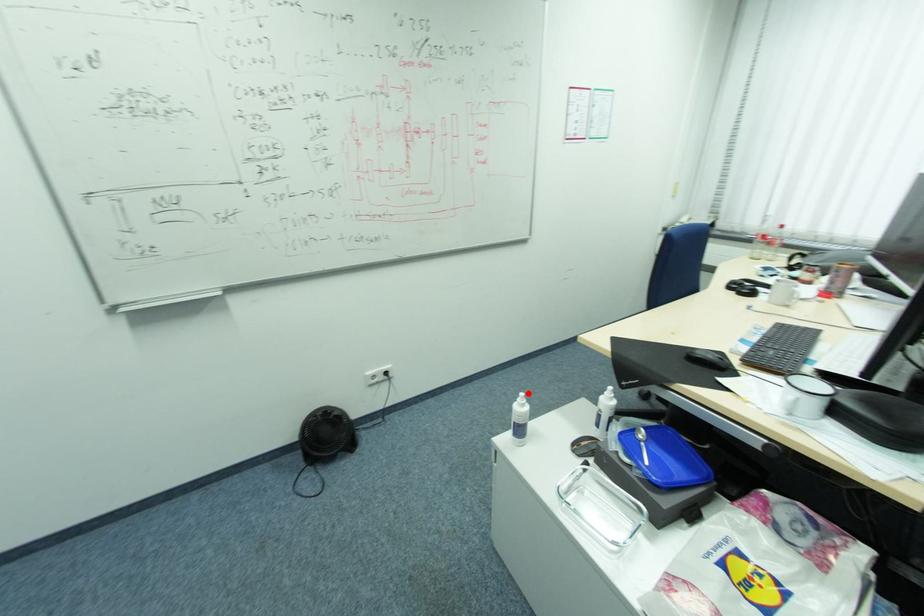
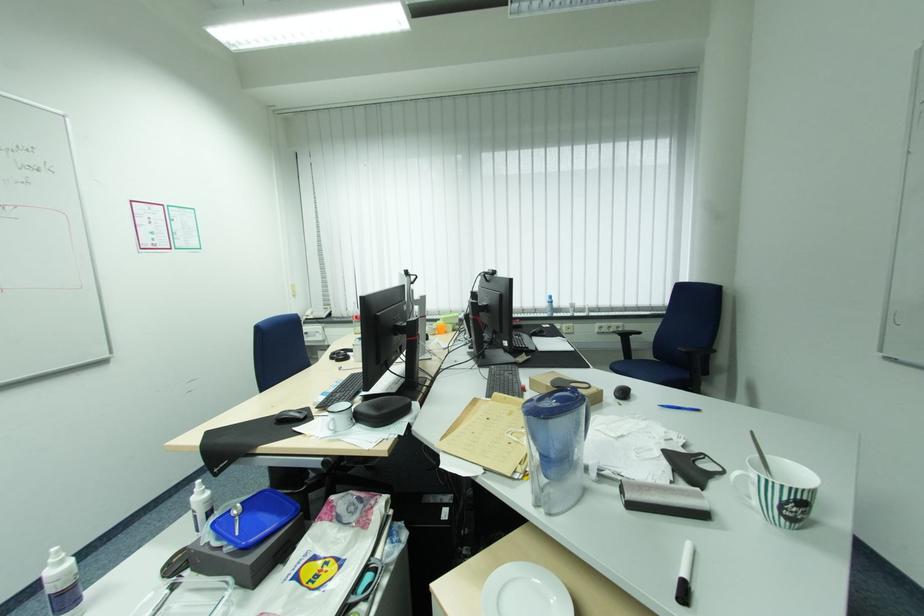
The point at the highlighted location is marked in the first image. Where is the corresponding point in the second image?

(62, 548)